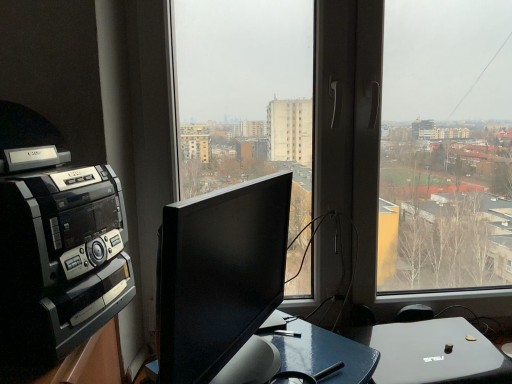
What do you see at coordinates (220, 274) in the screenshot? I see `black glossy monitor at center` at bounding box center [220, 274].

This screenshot has height=384, width=512. In order to click on transparent glass window at center in this screenshot , I will do `click(362, 124)`.

Identify the location of black plastic amplifier at left. (59, 253).

Can you tell me how much transparent glass window at center and black glossy monitor at center differ in facing direction?

57 degrees.

From the picture: Between transparent glass window at center and black glossy monitor at center, which one has smaller size?

black glossy monitor at center.

How distant is transparent glass window at center from black glossy monitor at center?

transparent glass window at center and black glossy monitor at center are 28.23 inches apart from each other.

Considering the positions of objects transparent glass window at center and black glossy monitor at center in the image provided, who is more to the left, transparent glass window at center or black glossy monitor at center?

From the viewer's perspective, black glossy monitor at center appears more on the left side.

Would you say black glossy monitor at center contains black plastic amplifier at left?

That's incorrect, black plastic amplifier at left is not inside black glossy monitor at center.

Considering the relative sizes of black glossy monitor at center and black plastic amplifier at left in the image provided, is black glossy monitor at center smaller than black plastic amplifier at left?

Yes.

Between black glossy monitor at center and black plastic amplifier at left, which one appears on the left side from the viewer's perspective?

black plastic amplifier at left.

Which is in front, black glossy monitor at center or black plastic amplifier at left?

black glossy monitor at center is closer to the camera.

Considering the points (417, 199) and (86, 274), which point is behind, point (417, 199) or point (86, 274)?

The point (417, 199) is farther.

Considering the sizes of objects transparent glass window at center and black plastic amplifier at left in the image provided, who is wider, transparent glass window at center or black plastic amplifier at left?

Wider between the two is black plastic amplifier at left.

How many degrees apart are the facing directions of transparent glass window at center and black plastic amplifier at left?

They differ by 72.1 degrees in their facing directions.

Considering the relative sizes of transparent glass window at center and black plastic amplifier at left in the image provided, is transparent glass window at center bigger than black plastic amplifier at left?

Indeed, transparent glass window at center has a larger size compared to black plastic amplifier at left.

Are black plastic amplifier at left and transparent glass window at center far apart?

No, black plastic amplifier at left is not far from transparent glass window at center.

Based on the photo, can you confirm if black plastic amplifier at left is thinner than transparent glass window at center?

In fact, black plastic amplifier at left might be wider than transparent glass window at center.

Is black plastic amplifier at left located outside transparent glass window at center?

Yes, black plastic amplifier at left is not within transparent glass window at center.

Could you tell me if black plastic amplifier at left is facing transparent glass window at center?

No.

Considering the sizes of black plastic amplifier at left and black glossy monitor at center in the image, is black plastic amplifier at left taller or shorter than black glossy monitor at center?

Clearly, black plastic amplifier at left is taller compared to black glossy monitor at center.

From the picture: Considering the sizes of objects black plastic amplifier at left and black glossy monitor at center in the image provided, who is thinner, black plastic amplifier at left or black glossy monitor at center?

black glossy monitor at center is thinner.

Does black plastic amplifier at left have a smaller size compared to black glossy monitor at center?

No.

Is black glossy monitor at center touching transparent glass window at center?

No.

From the image's perspective, who appears lower, black glossy monitor at center or transparent glass window at center?

black glossy monitor at center appears lower in the image.

Looking at this image, is black glossy monitor at center closer to the viewer compared to transparent glass window at center?

Yes, black glossy monitor at center is in front of transparent glass window at center.

Is black glossy monitor at center positioned beyond the bounds of transparent glass window at center?

Absolutely, black glossy monitor at center is external to transparent glass window at center.

Image resolution: width=512 pixels, height=384 pixels. I want to click on window behind the black glossy monitor at center, so click(x=362, y=124).

In order to click on amplifier that appears above the black glossy monitor at center (from a real-world perspective) in this screenshot , I will do click(x=59, y=253).

Looking at the image, which one is located closer to transparent glass window at center, black glossy monitor at center or black plastic amplifier at left?

The object closer to transparent glass window at center is black glossy monitor at center.

When comparing their distances from transparent glass window at center, does black plastic amplifier at left or black glossy monitor at center seem closer?

black glossy monitor at center is positioned closer to the anchor transparent glass window at center.

From the image, which object appears to be nearer to black plastic amplifier at left, black glossy monitor at center or transparent glass window at center?

The object closer to black plastic amplifier at left is black glossy monitor at center.

Which object lies further to the anchor point black glossy monitor at center, transparent glass window at center or black plastic amplifier at left?

Result: The object further to black glossy monitor at center is transparent glass window at center.

Considering their positions, is transparent glass window at center positioned closer to black plastic amplifier at left than black glossy monitor at center?

black glossy monitor at center lies closer to black plastic amplifier at left than the other object.

Based on their spatial positions, is black plastic amplifier at left or transparent glass window at center further from black glossy monitor at center?

transparent glass window at center lies further to black glossy monitor at center than the other object.

I want to click on computer monitor between black plastic amplifier at left and transparent glass window at center, so click(x=220, y=274).